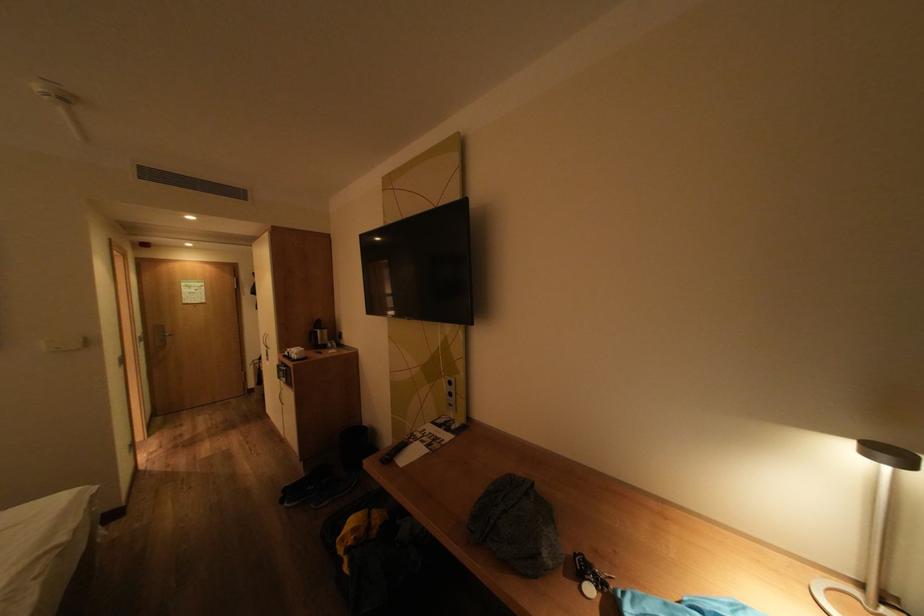
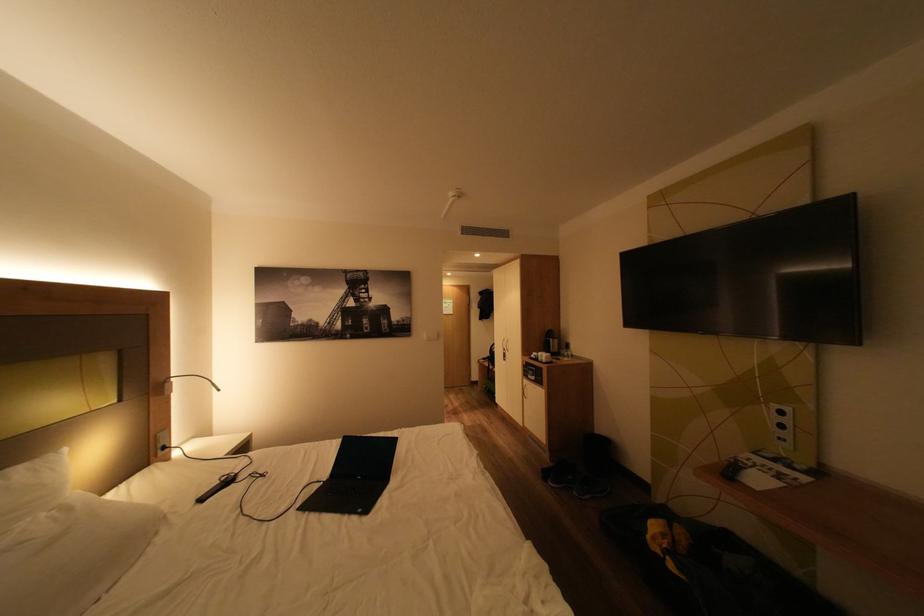
Where in the second image is the point corresponding to [460,395] from the first image?

(793, 427)